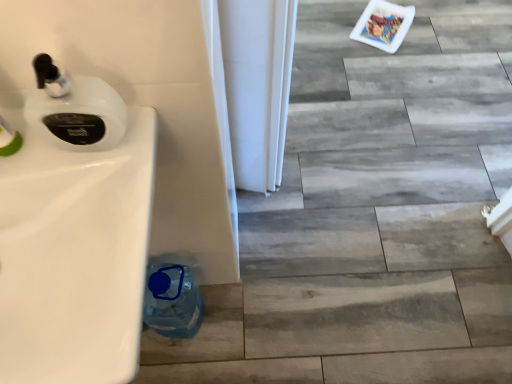
Where is `blue plastic bottle at lower left`? blue plastic bottle at lower left is located at coordinates (172, 300).

Locate an element on the screen. The width and height of the screenshot is (512, 384). white glossy sink at left is located at coordinates (74, 256).

Is there a large distance between white glossy soap dispenser at upper left and white glossy sink at left?

white glossy soap dispenser at upper left is actually quite close to white glossy sink at left.

Between white glossy soap dispenser at upper left and white glossy sink at left, which one appears on the right side from the viewer's perspective?

Positioned to the right is white glossy soap dispenser at upper left.

Which of these two, white glossy soap dispenser at upper left or white glossy sink at left, stands taller?

With more height is white glossy soap dispenser at upper left.

Do you think white glossy soap dispenser at upper left is within white glossy sink at left, or outside of it?

white glossy soap dispenser at upper left is spatially situated outside white glossy sink at left.

Considering the sizes of blue plastic bottle at lower left and white glossy soap dispenser at upper left in the image, is blue plastic bottle at lower left bigger or smaller than white glossy soap dispenser at upper left?

Clearly, blue plastic bottle at lower left is larger in size than white glossy soap dispenser at upper left.

Which object is positioned more to the left, blue plastic bottle at lower left or white glossy soap dispenser at upper left?

Positioned to the left is blue plastic bottle at lower left.

Where is `soap dispenser above the blue plastic bottle at lower left (from the image's perspective)`? This screenshot has height=384, width=512. soap dispenser above the blue plastic bottle at lower left (from the image's perspective) is located at coordinates (74, 109).

Can white glossy soap dispenser at upper left be found inside blue plastic bottle at lower left?

No, white glossy soap dispenser at upper left is not surrounded by blue plastic bottle at lower left.

Considering the positions of point (130, 207) and point (42, 102), is point (130, 207) closer or farther from the camera than point (42, 102)?

Point (130, 207).

From a real-world perspective, is white glossy sink at left physically above white glossy soap dispenser at upper left?

No, from a real-world perspective, white glossy sink at left is not above white glossy soap dispenser at upper left.

Could white glossy soap dispenser at upper left be considered to be inside white glossy sink at left?

No.

From the image's perspective, is white glossy sink at left located above white glossy soap dispenser at upper left?

No, from the image's perspective, white glossy sink at left is not above white glossy soap dispenser at upper left.

The image size is (512, 384). Identify the location of bottle that appears below the white glossy sink at left (from the image's perspective). (172, 300).

Considering the sizes of objects white glossy sink at left and blue plastic bottle at lower left in the image provided, who is shorter, white glossy sink at left or blue plastic bottle at lower left?

white glossy sink at left is shorter.

Is white glossy sink at left spatially inside blue plastic bottle at lower left, or outside of it?

white glossy sink at left is not inside blue plastic bottle at lower left, it's outside.

From a real-world perspective, is white glossy sink at left positioned over blue plastic bottle at lower left based on gravity?

Yes, from a real-world perspective, white glossy sink at left is over blue plastic bottle at lower left

From a real-world perspective, which object stands above the other?

white glossy soap dispenser at upper left, from a real-world perspective.

Is white glossy soap dispenser at upper left not near blue plastic bottle at lower left?

No, white glossy soap dispenser at upper left is not far from blue plastic bottle at lower left.

Is white glossy soap dispenser at upper left outside of blue plastic bottle at lower left?

Yes, white glossy soap dispenser at upper left is outside of blue plastic bottle at lower left.

Is white glossy soap dispenser at upper left facing away from blue plastic bottle at lower left?

No, white glossy soap dispenser at upper left is not facing away from blue plastic bottle at lower left.

From the image's perspective, does blue plastic bottle at lower left appear higher than white glossy sink at left?

Actually, blue plastic bottle at lower left appears below white glossy sink at left in the image.

You are a GUI agent. You are given a task and a screenshot of the screen. Output one action in this format:
    pyautogui.click(x=<x>, y=<y>)
    Task: Click on the sink positioned vertically above the blue plastic bottle at lower left (from a real-world perspective)
    This screenshot has width=512, height=384.
    Given the screenshot: What is the action you would take?
    pyautogui.click(x=74, y=256)

Is blue plastic bottle at lower left outside of white glossy sink at left?

blue plastic bottle at lower left is positioned outside white glossy sink at left.

Which point is more forward, (167, 308) or (101, 359)?

The point (101, 359) is in front.

This screenshot has height=384, width=512. I want to click on sink below the white glossy soap dispenser at upper left (from a real-world perspective), so click(x=74, y=256).

Find the location of a particular element. bottle below the white glossy soap dispenser at upper left (from the image's perspective) is located at coordinates (172, 300).

When comparing their distances from white glossy sink at left, does white glossy soap dispenser at upper left or blue plastic bottle at lower left seem closer?

Based on the image, white glossy soap dispenser at upper left appears to be nearer to white glossy sink at left.

From the image, which object appears to be nearer to white glossy soap dispenser at upper left, white glossy sink at left or blue plastic bottle at lower left?

white glossy sink at left lies closer to white glossy soap dispenser at upper left than the other object.

Which object lies nearer to the anchor point white glossy soap dispenser at upper left, blue plastic bottle at lower left or white glossy sink at left?

white glossy sink at left is positioned closer to the anchor white glossy soap dispenser at upper left.

From the image, which object appears to be nearer to blue plastic bottle at lower left, white glossy soap dispenser at upper left or white glossy sink at left?

Based on the image, white glossy sink at left appears to be nearer to blue plastic bottle at lower left.

Which object lies nearer to the anchor point blue plastic bottle at lower left, white glossy sink at left or white glossy soap dispenser at upper left?

Based on the image, white glossy sink at left appears to be nearer to blue plastic bottle at lower left.

From the image, which object appears to be farther from white glossy sink at left, blue plastic bottle at lower left or white glossy soap dispenser at upper left?

Among the two, blue plastic bottle at lower left is located further to white glossy sink at left.

Locate an element on the screen. Image resolution: width=512 pixels, height=384 pixels. soap dispenser positioned between white glossy sink at left and blue plastic bottle at lower left from near to far is located at coordinates (74, 109).